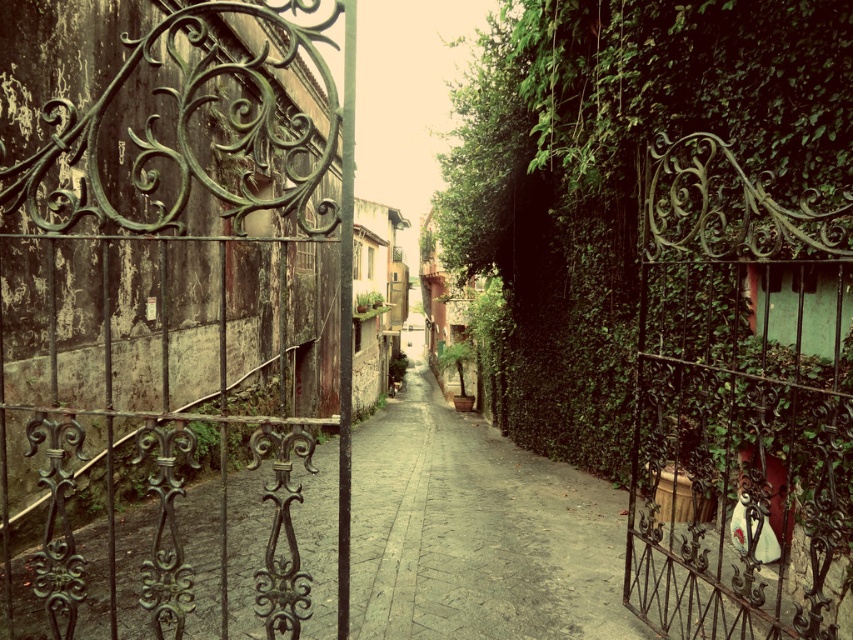
Measure the distance between green wrought iron gate at left and camera.

green wrought iron gate at left is 8.93 feet from camera.

Who is more forward, (303,296) or (781,614)?

Point (781,614)

At what (x,y) coordinates should I click in order to perform the action: click on green wrought iron gate at left. Please return your answer as a coordinate pair (x, y). This screenshot has width=853, height=640. Looking at the image, I should click on (173, 291).